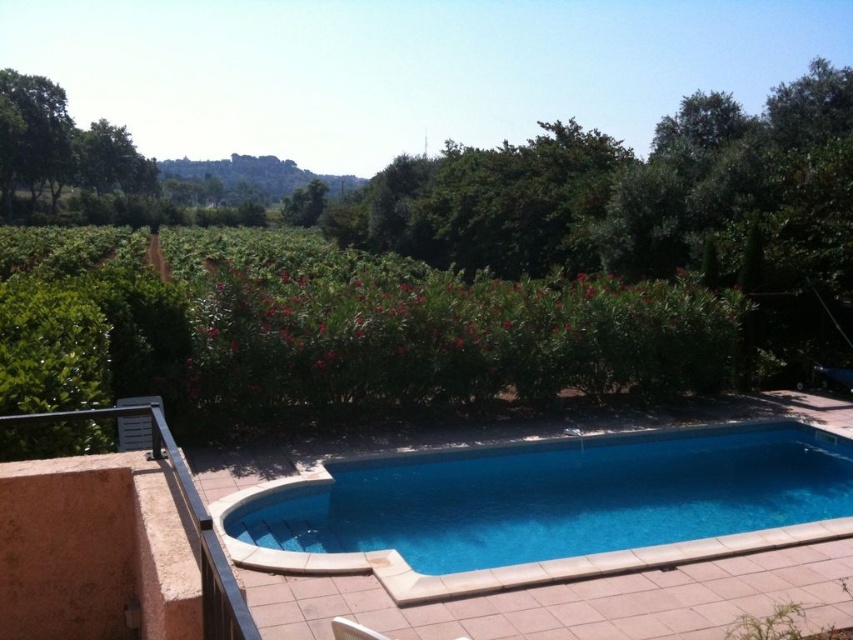
You are standing at the center of the pool and want to locate the green leafy tree at upper left. According to the coordinates, where is the tree positioned relative to you?

The green leafy tree at upper left is positioned at coordinates point [61,147], which places it to the upper left relative to your position at the center of the pool.

You are standing on the patio and want to walk to the blue smooth pool at center. Which direction should you face to move towards it from the green leafy tree at upper left?

The blue smooth pool at center is to the right of the green leafy tree at upper left, so you should face towards the right direction to move towards it from the green leafy tree at upper left.

You are standing at the edge of the pool and want to reach both the point at position (447, 544) and the point at (280, 216). Which point is closer to you?

Point (447, 544) is closer to the camera than point (280, 216), so the point at (447, 544) is closer to you.